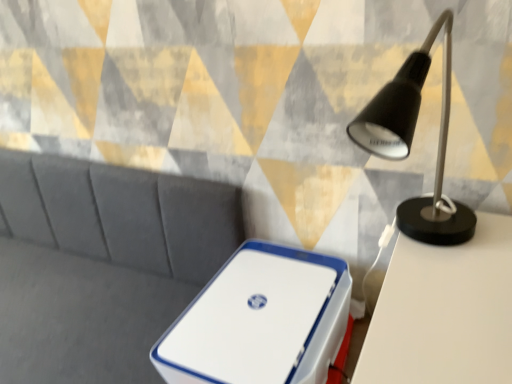
Question: From the image's perspective, is black matte desk lamp at upper right positioned above or below white plastic storage box at center?

Choices:
 (A) below
 (B) above

Answer: (B)

Question: Is black matte desk lamp at upper right inside or outside of white plastic storage box at center?

Choices:
 (A) inside
 (B) outside

Answer: (B)

Question: Considering the positions of point (432, 205) and point (225, 334), is point (432, 205) closer or farther from the camera than point (225, 334)?

Choices:
 (A) closer
 (B) farther

Answer: (A)

Question: Is white plastic storage box at center bigger or smaller than black matte desk lamp at upper right?

Choices:
 (A) small
 (B) big

Answer: (A)

Question: Based on their positions, is white plastic storage box at center located to the left or right of black matte desk lamp at upper right?

Choices:
 (A) right
 (B) left

Answer: (B)

Question: From their relative heights in the image, would you say white plastic storage box at center is taller or shorter than black matte desk lamp at upper right?

Choices:
 (A) tall
 (B) short

Answer: (B)

Question: From the image's perspective, relative to black matte desk lamp at upper right, is white plastic storage box at center above or below?

Choices:
 (A) above
 (B) below

Answer: (B)